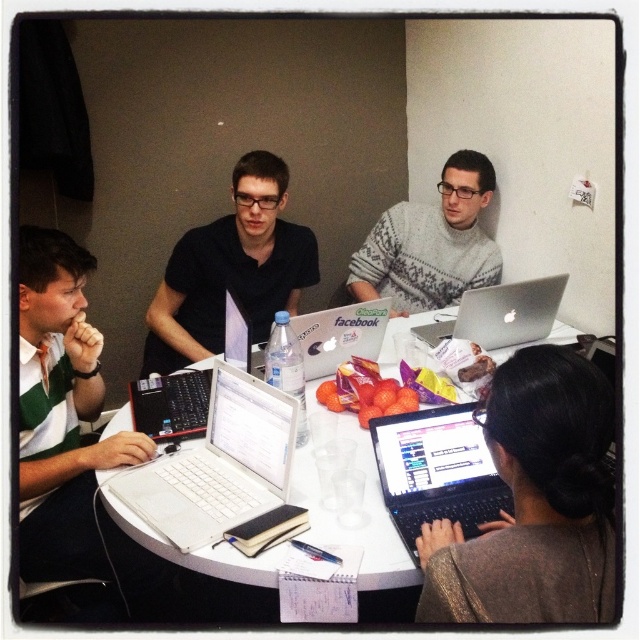
Question: Does matte black shirt at center have a greater width compared to gray knitted sweater at center?

Choices:
 (A) no
 (B) yes

Answer: (B)

Question: From the image, what is the correct spatial relationship of brown fabric hair at lower right in relation to white matte laptop at center?

Choices:
 (A) above
 (B) below

Answer: (A)

Question: Among these objects, which one is nearest to the camera?

Choices:
 (A) gray knitted sweater at center
 (B) white plastic table at center

Answer: (B)

Question: Which point appears closest to the camera in this image?

Choices:
 (A) (83, 374)
 (B) (253, 202)

Answer: (A)

Question: Which point is farther from the camera taking this photo?

Choices:
 (A) (486, 481)
 (B) (444, 324)
 (C) (195, 513)
 (D) (156, 339)

Answer: (D)

Question: Does white plastic table at center have a smaller size compared to gray knitted sweater at center?

Choices:
 (A) yes
 (B) no

Answer: (B)